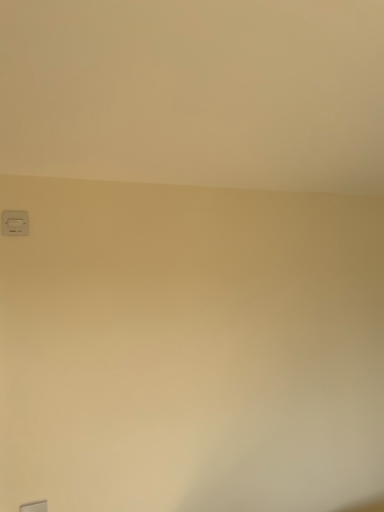
Question: Is white plastic light switch at upper left far away from transparent glass window at lower left?

Choices:
 (A) no
 (B) yes

Answer: (A)

Question: From the image's perspective, is white plastic light switch at upper left located beneath transparent glass window at lower left?

Choices:
 (A) no
 (B) yes

Answer: (A)

Question: Can you confirm if white plastic light switch at upper left is bigger than transparent glass window at lower left?

Choices:
 (A) yes
 (B) no

Answer: (A)

Question: Can you see white plastic light switch at upper left touching transparent glass window at lower left?

Choices:
 (A) yes
 (B) no

Answer: (B)

Question: From a real-world perspective, is white plastic light switch at upper left under transparent glass window at lower left?

Choices:
 (A) no
 (B) yes

Answer: (A)

Question: Can transparent glass window at lower left be found inside white plastic light switch at upper left?

Choices:
 (A) no
 (B) yes

Answer: (A)

Question: Is transparent glass window at lower left at the left side of white plastic light switch at upper left?

Choices:
 (A) no
 (B) yes

Answer: (A)

Question: Does transparent glass window at lower left come behind white plastic light switch at upper left?

Choices:
 (A) no
 (B) yes

Answer: (A)

Question: Is transparent glass window at lower left placed right next to white plastic light switch at upper left?

Choices:
 (A) yes
 (B) no

Answer: (B)

Question: Is transparent glass window at lower left looking in the opposite direction of white plastic light switch at upper left?

Choices:
 (A) no
 (B) yes

Answer: (A)

Question: From a real-world perspective, is transparent glass window at lower left positioned under white plastic light switch at upper left based on gravity?

Choices:
 (A) no
 (B) yes

Answer: (B)

Question: Does transparent glass window at lower left have a greater width compared to white plastic light switch at upper left?

Choices:
 (A) no
 (B) yes

Answer: (A)

Question: Considering the positions of white plastic light switch at upper left and transparent glass window at lower left in the image, is white plastic light switch at upper left taller or shorter than transparent glass window at lower left?

Choices:
 (A) short
 (B) tall

Answer: (B)